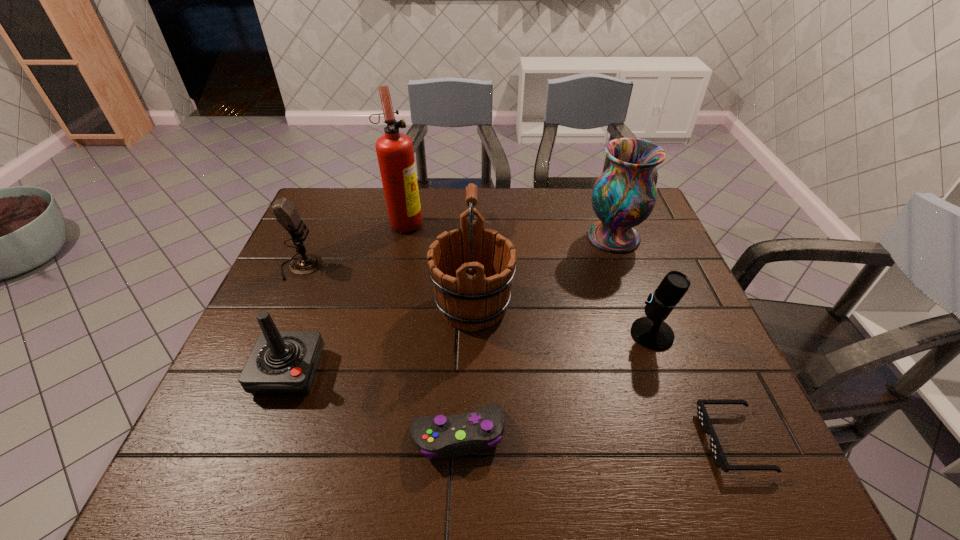
In order to click on control located in the near edge section of the desktop in this screenshot , I will do `click(468, 433)`.

The height and width of the screenshot is (540, 960). I want to click on sunglasses that is at the near edge, so click(x=716, y=450).

Find the location of a particular element. microphone located at the left edge is located at coordinates (286, 214).

Locate an element on the screen. The image size is (960, 540). joystick positioned at the left edge is located at coordinates (282, 363).

Where is `vase that is at the right edge`? The image size is (960, 540). vase that is at the right edge is located at coordinates click(x=624, y=195).

Where is `microphone at the right edge`? The image size is (960, 540). microphone at the right edge is located at coordinates (651, 332).

At what (x,y) coordinates should I click in order to perform the action: click on sunglasses situated at the right edge. Please return your answer as a coordinate pair (x, y). The image size is (960, 540). Looking at the image, I should click on (716, 450).

Where is `object that is at the far right corner`? The height and width of the screenshot is (540, 960). object that is at the far right corner is located at coordinates (624, 195).

Locate an element on the screen. The width and height of the screenshot is (960, 540). object located in the near right corner section of the desktop is located at coordinates (716, 450).

The height and width of the screenshot is (540, 960). In the image, there is a desktop. What are the coordinates of `vacant area at the far edge` in the screenshot? It's located at (575, 207).